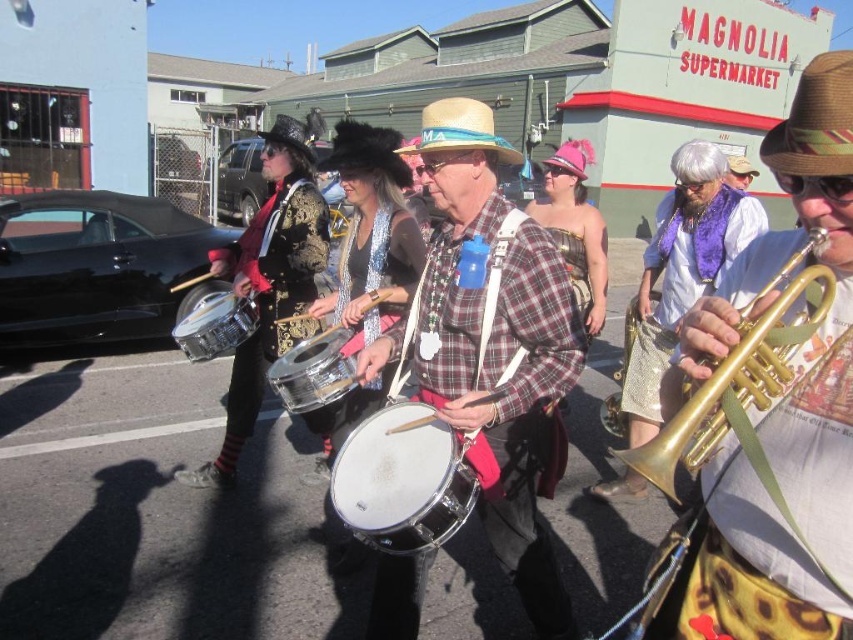
Image resolution: width=853 pixels, height=640 pixels. What do you see at coordinates (270, 282) in the screenshot? I see `brushed metal drum at left` at bounding box center [270, 282].

Which is above, brushed metal drum at left or gold brass trumpet at right?

brushed metal drum at left is higher up.

The image size is (853, 640). Describe the element at coordinates (270, 282) in the screenshot. I see `brushed metal drum at left` at that location.

Where is `brushed metal drum at left`? The height and width of the screenshot is (640, 853). brushed metal drum at left is located at coordinates (270, 282).

Can you confirm if brown woven cowboy hat at upper right is shorter than black fur cowboy hat at center?

Yes.

Based on the photo, can you confirm if brown woven cowboy hat at upper right is positioned above black fur cowboy hat at center?

No, brown woven cowboy hat at upper right is not above black fur cowboy hat at center.

Who is more forward, (792,120) or (396,147)?

Point (792,120) is in front.

Where is `brown woven cowboy hat at upper right`? This screenshot has height=640, width=853. brown woven cowboy hat at upper right is located at coordinates [815, 122].

Which is more to the right, metallic silver drum at center or straw hat at center?

metallic silver drum at center

Is the position of metallic silver drum at center less distant than that of straw hat at center?

Yes, metallic silver drum at center is in front of straw hat at center.

The height and width of the screenshot is (640, 853). I want to click on metallic silver drum at center, so click(773, 454).